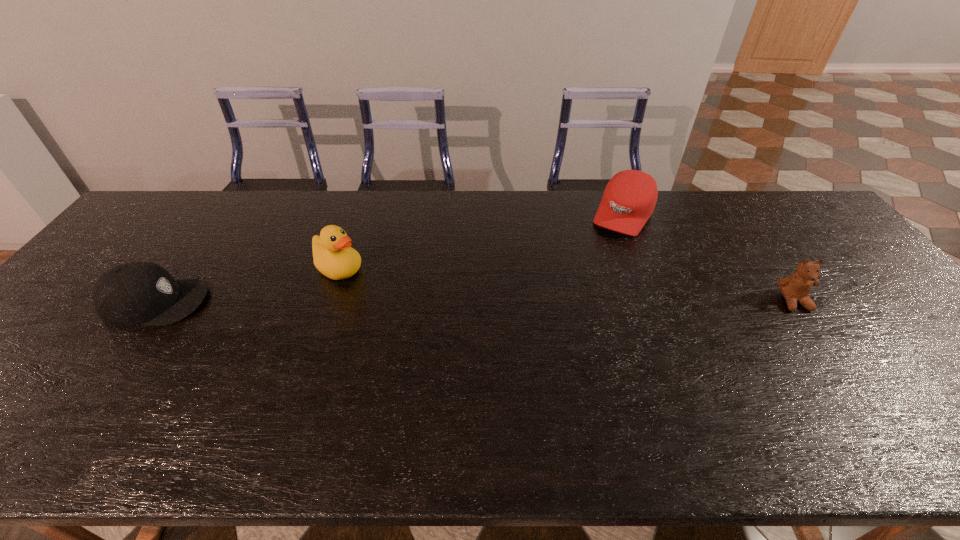
This screenshot has height=540, width=960. I want to click on the left cap, so click(x=140, y=293).

Where is `the nearer cap`? the nearer cap is located at coordinates (140, 293).

Find the location of a particular element. Image resolution: width=960 pixels, height=540 pixels. the rightmost object is located at coordinates (796, 287).

Locate an element on the screen. The width and height of the screenshot is (960, 540). the third object from right to left is located at coordinates (332, 255).

Where is `the tallest object`? the tallest object is located at coordinates (332, 255).

Image resolution: width=960 pixels, height=540 pixels. I want to click on the second object from right to left, so click(629, 199).

Identify the location of the farthest object. This screenshot has height=540, width=960. (629, 199).

This screenshot has width=960, height=540. What are the coordinates of `free space located on the front-facing side of the left cap` in the screenshot? It's located at (288, 302).

Where is `vacant space located on the face of the teddy bear`? vacant space located on the face of the teddy bear is located at coordinates (867, 407).

Locate an element on the screen. vacant space located at the beak of the tallest object is located at coordinates [x=384, y=292].